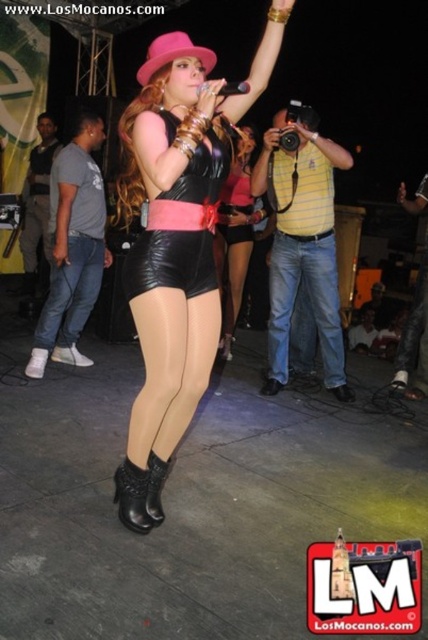
Locate an element on the screen. Image resolution: width=428 pixels, height=640 pixels. matte black leather shorts at center is located at coordinates (178, 240).

I want to click on matte black leather shorts at center, so click(178, 240).

Is jeans at center behind leather shorts at center?

No, jeans at center is in front of leather shorts at center.

Image resolution: width=428 pixels, height=640 pixels. In order to click on jeans at center in this screenshot , I will do `click(306, 301)`.

Between matte black leather shorts at center and jeans at center, which one is positioned higher?

matte black leather shorts at center

Does matte black leather shorts at center have a greater width compared to jeans at center?

Indeed, matte black leather shorts at center has a greater width compared to jeans at center.

Is point (155, 76) farther from viewer compared to point (318, 264)?

That is False.

Image resolution: width=428 pixels, height=640 pixels. Identify the location of matte black leather shorts at center. (178, 240).